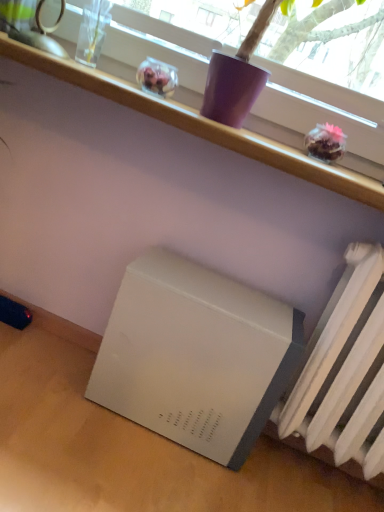
At what (x,y) coordinates should I click in order to perform the action: click on free point above white matte refrigerator at lower left (from a real-world perspective). Please return your answer as a coordinate pair (x, y). The width and height of the screenshot is (384, 512). Looking at the image, I should click on (220, 288).